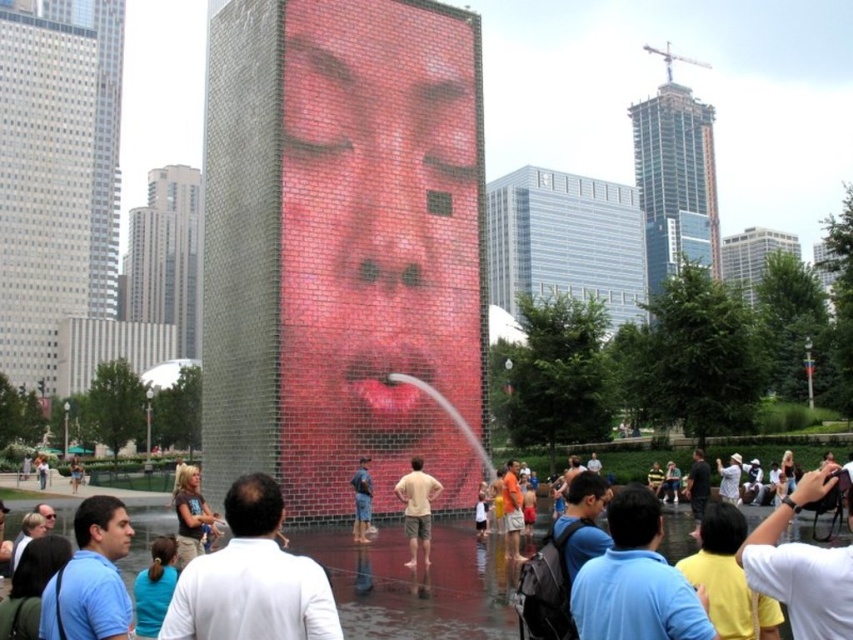
Question: Which of the following is the closest to the observer?

Choices:
 (A) smooth skin face at center
 (B) brown leather jacket at lower left

Answer: (B)

Question: Is light beige cotton shirt at center closer to camera compared to matte skin face at lower left?

Choices:
 (A) yes
 (B) no

Answer: (B)

Question: Estimate the real-world distances between objects in this image. Which object is farther from the brown leather jacket at lower left?

Choices:
 (A) light beige cotton shirt at center
 (B) matte skin face at lower left
 (C) denim shorts at center

Answer: (B)

Question: Can you confirm if brick-patterned face at center is positioned to the left of denim shorts at center?

Choices:
 (A) no
 (B) yes

Answer: (A)

Question: Is matte black shirt at center thinner than light beige cotton shirt at center?

Choices:
 (A) no
 (B) yes

Answer: (A)

Question: Which object is farther from the camera taking this photo?

Choices:
 (A) matte black shirt at center
 (B) brown leather jacket at lower left
 (C) smooth skin face at center

Answer: (C)